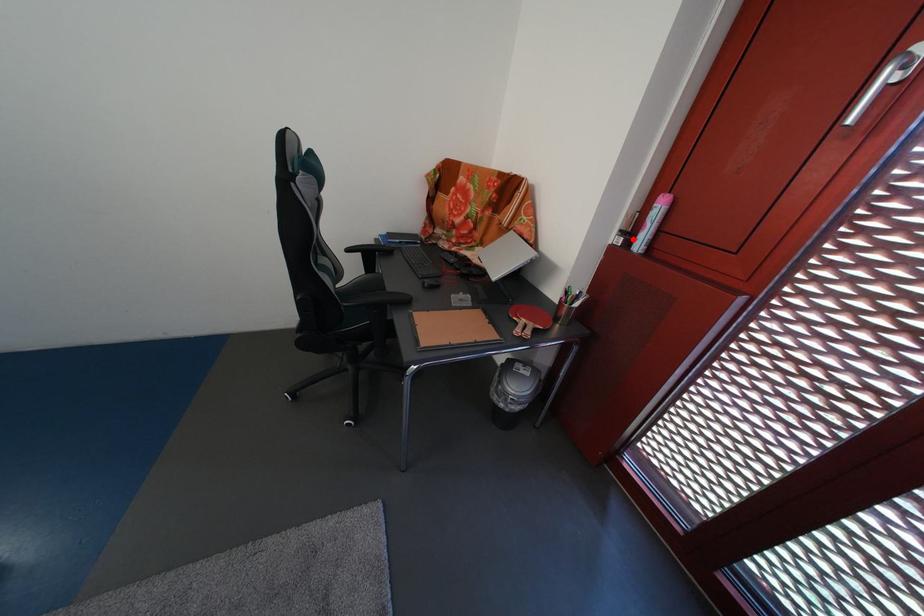
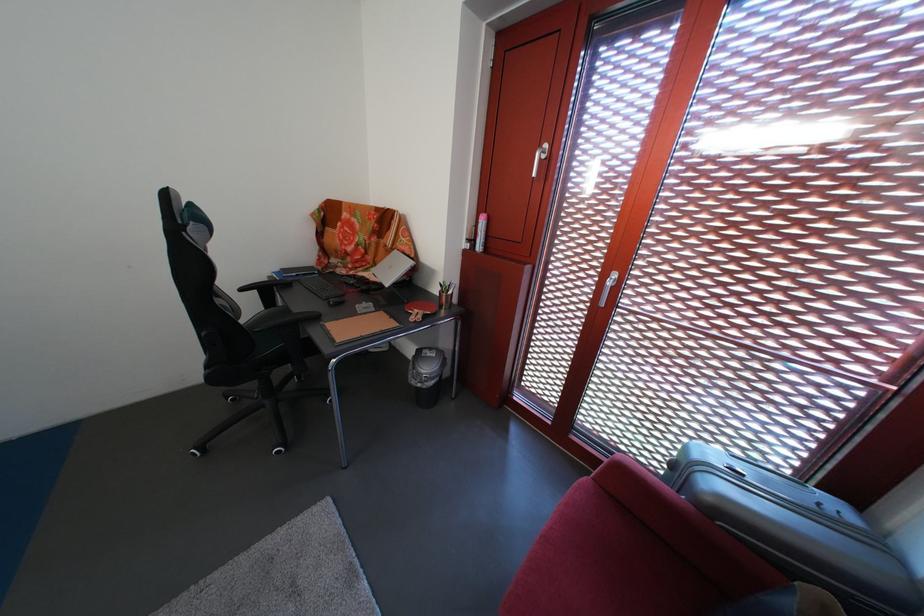
Find the pixel in the second image that matches the highlighted location in the first image.

(479, 246)